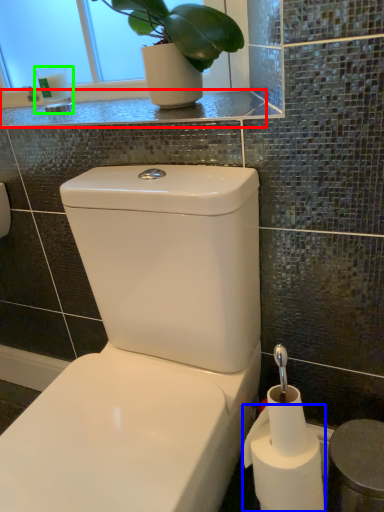
Question: Which object is the closest to the counter top (highlighted by a red box)? Choose among these: toilet paper (highlighted by a blue box) or toiletry (highlighted by a green box).

Choices:
 (A) toilet paper
 (B) toiletry

Answer: (B)